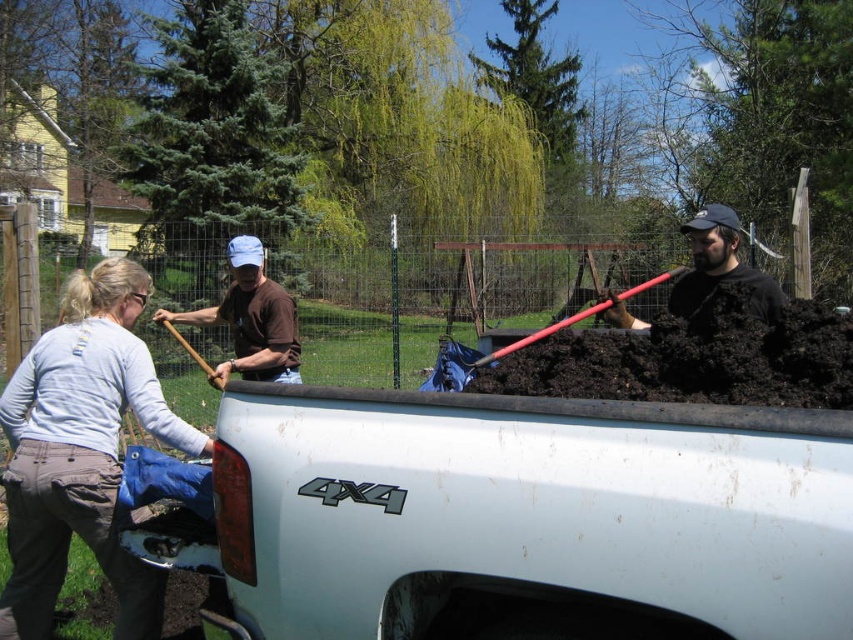
You are standing in the garden area and want to hand a tool to the person wearing the brown cotton shirt at upper center. The matte black shovel at center is between you and them. Can you directly hand them the shovel without moving the shovel?

The brown cotton shirt at upper center is further to the viewer than the matte black shovel at center, meaning the shovel is closer to you. Since the shovel is between you and the person, you cannot directly hand them the shovel without moving it because the shovel is in front of the person.